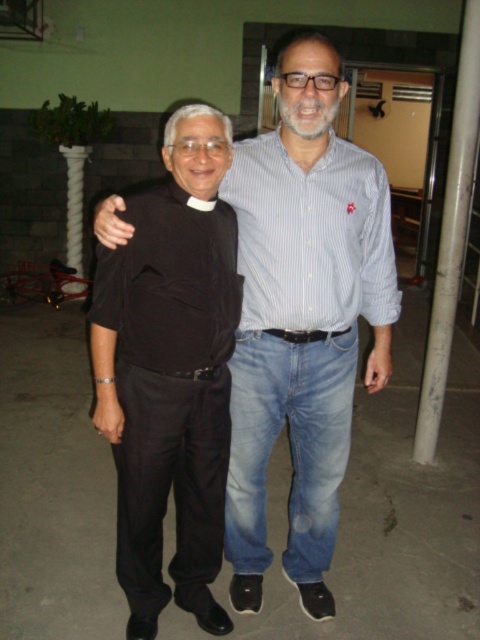
Is point (141, 595) positioned after point (237, 211)?

Yes, it is behind point (237, 211).

Who is shorter, black matte shirt at center or blue striped shirt at center?

blue striped shirt at center is shorter.

What do you see at coordinates (169, 371) in the screenshot?
I see `black matte shirt at center` at bounding box center [169, 371].

Image resolution: width=480 pixels, height=640 pixels. I want to click on black matte shirt at center, so click(x=169, y=371).